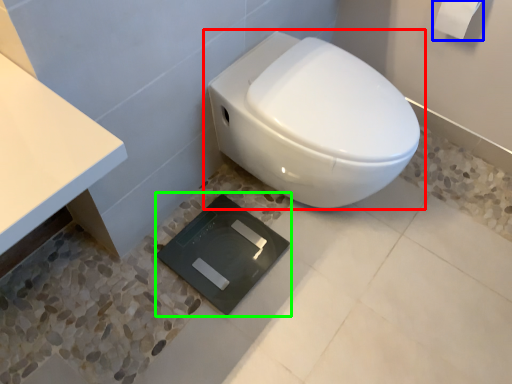
Question: Considering the real-world distances, which object is farthest from toilet (highlighted by a red box)? toilet paper (highlighted by a blue box) or pad (highlighted by a green box)?

Choices:
 (A) toilet paper
 (B) pad

Answer: (A)